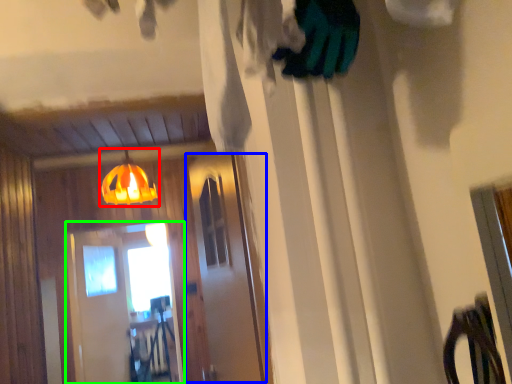
Question: Based on their relative distances, which object is nearer to lamp (highlighted by a red box)? Choose from screen door (highlighted by a blue box) and screen door (highlighted by a green box).

Choices:
 (A) screen door
 (B) screen door

Answer: (B)